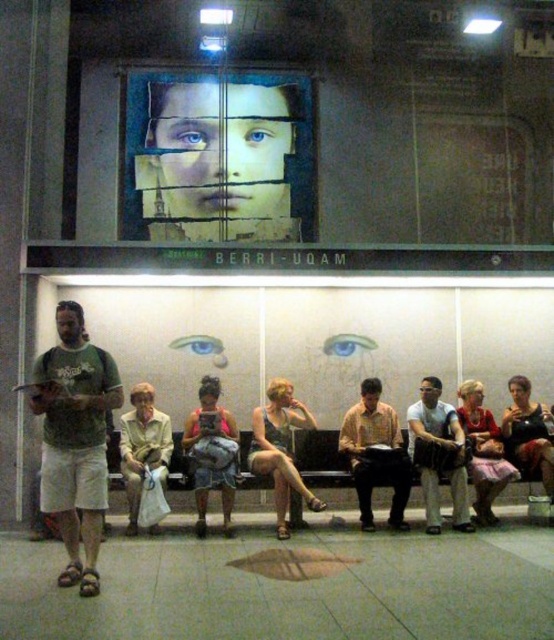
Does smooth textured face at center appear under green cotton t-shirt at left?

Actually, smooth textured face at center is above green cotton t-shirt at left.

Is point (213, 196) farther from camera compared to point (80, 433)?

Yes, it is behind point (80, 433).

What do you see at coordinates (218, 161) in the screenshot? I see `smooth textured face at center` at bounding box center [218, 161].

The height and width of the screenshot is (640, 554). What are the coordinates of `smooth textured face at center` in the screenshot? It's located at (218, 161).

What do you see at coordinates (75, 440) in the screenshot?
I see `green cotton t-shirt at left` at bounding box center [75, 440].

Who is positioned more to the left, green cotton t-shirt at left or matte black purse at lower right?

From the viewer's perspective, green cotton t-shirt at left appears more on the left side.

This screenshot has width=554, height=640. Find the location of `green cotton t-shirt at left`. green cotton t-shirt at left is located at coordinates (75, 440).

Which is above, green cotton t-shirt at left or light beige fabric bag at center?

green cotton t-shirt at left is above.

Which of these two, green cotton t-shirt at left or light beige fabric bag at center, stands shorter?

With less height is light beige fabric bag at center.

Is point (75, 376) positioned after point (131, 525)?

That is False.

Identify the location of green cotton t-shirt at left. Image resolution: width=554 pixels, height=640 pixels. (75, 440).